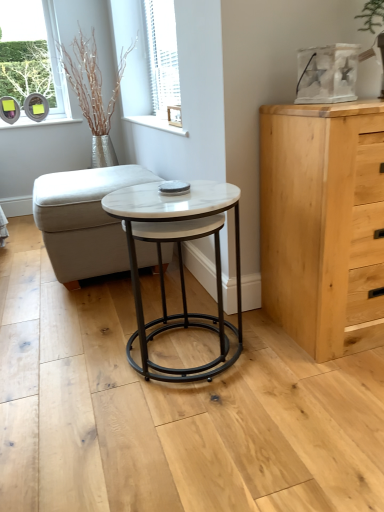
Question: Considering the relative positions of white textured blinds at upper center and silver metallic vase at upper left in the image provided, is white textured blinds at upper center to the left of silver metallic vase at upper left from the viewer's perspective?

Choices:
 (A) yes
 (B) no

Answer: (B)

Question: From a real-world perspective, is white textured blinds at upper center on top of silver metallic vase at upper left?

Choices:
 (A) yes
 (B) no

Answer: (A)

Question: Can you confirm if white textured blinds at upper center is thinner than silver metallic vase at upper left?

Choices:
 (A) no
 (B) yes

Answer: (B)

Question: Is white textured blinds at upper center facing towards silver metallic vase at upper left?

Choices:
 (A) no
 (B) yes

Answer: (B)

Question: Considering the relative positions of white textured blinds at upper center and silver metallic vase at upper left in the image provided, is white textured blinds at upper center in front of silver metallic vase at upper left?

Choices:
 (A) no
 (B) yes

Answer: (B)

Question: Does white textured blinds at upper center have a larger size compared to silver metallic vase at upper left?

Choices:
 (A) no
 (B) yes

Answer: (A)

Question: Considering the relative sizes of white textured blinds at upper center and light wood chest of drawers at right in the image provided, is white textured blinds at upper center taller than light wood chest of drawers at right?

Choices:
 (A) yes
 (B) no

Answer: (A)

Question: Is white textured blinds at upper center bigger than light wood chest of drawers at right?

Choices:
 (A) no
 (B) yes

Answer: (A)

Question: From a real-world perspective, is white textured blinds at upper center beneath light wood chest of drawers at right?

Choices:
 (A) yes
 (B) no

Answer: (B)

Question: Can you see white textured blinds at upper center touching light wood chest of drawers at right?

Choices:
 (A) no
 (B) yes

Answer: (A)

Question: Is white textured blinds at upper center further to camera compared to light wood chest of drawers at right?

Choices:
 (A) yes
 (B) no

Answer: (A)

Question: From the image's perspective, would you say white textured blinds at upper center is shown under light wood chest of drawers at right?

Choices:
 (A) no
 (B) yes

Answer: (A)

Question: From the image's perspective, is light wood chest of drawers at right on top of white fabric ottoman at center?

Choices:
 (A) no
 (B) yes

Answer: (A)